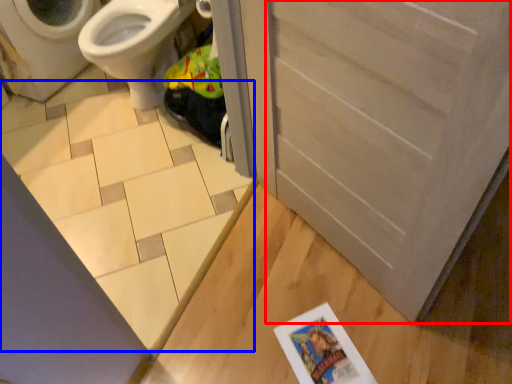
Question: Which of the following is the closest to the observer, screen door (highlighted by a red box) or tile (highlighted by a blue box)?

Choices:
 (A) screen door
 (B) tile

Answer: (A)